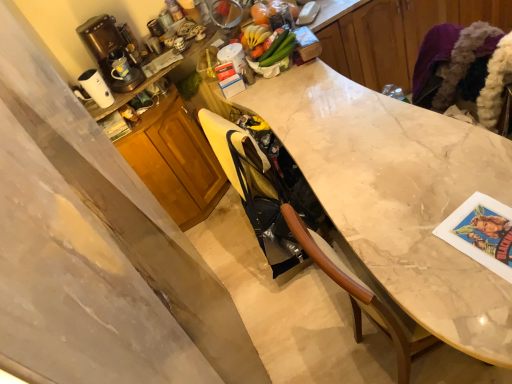
Find the location of a particular element. empty space that is ontop of marble at center (from a real-world perspective) is located at coordinates (352, 140).